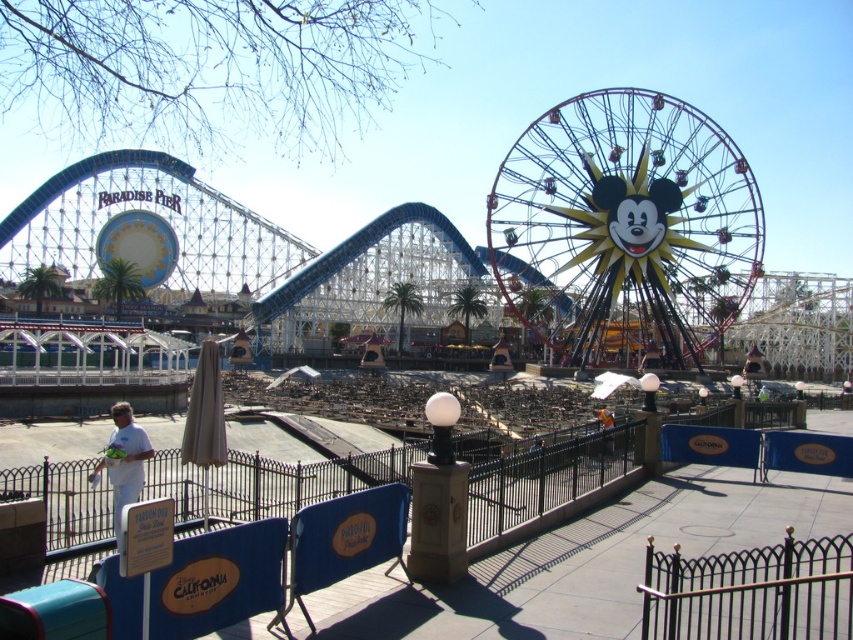
Question: Which point is farther to the camera?

Choices:
 (A) (608, 195)
 (B) (131, 477)

Answer: (A)

Question: Which object appears closest to the camera in this image?

Choices:
 (A) white matte shirt at lower left
 (B) metallic yellow ferris wheel at center

Answer: (A)

Question: Does metallic yellow ferris wheel at center appear over white matte shirt at lower left?

Choices:
 (A) yes
 (B) no

Answer: (A)

Question: Among these objects, which one is nearest to the camera?

Choices:
 (A) white matte shirt at lower left
 (B) metallic yellow ferris wheel at center

Answer: (A)

Question: Can you confirm if metallic yellow ferris wheel at center is smaller than white matte shirt at lower left?

Choices:
 (A) no
 (B) yes

Answer: (A)

Question: Is metallic yellow ferris wheel at center to the left of white matte shirt at lower left from the viewer's perspective?

Choices:
 (A) no
 (B) yes

Answer: (A)